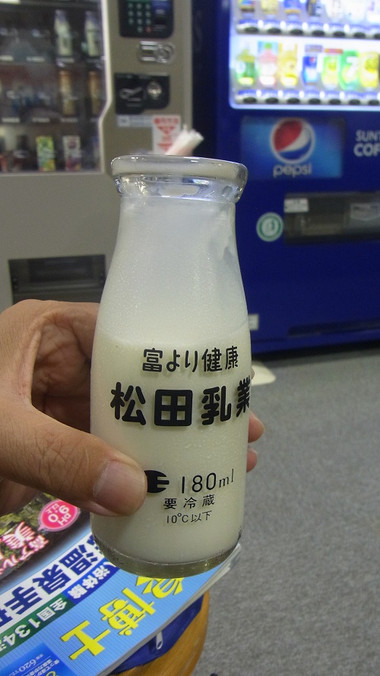
Locate an element on the screen. part of the vending machine where you input the number of the item you want is located at coordinates (139, 15).